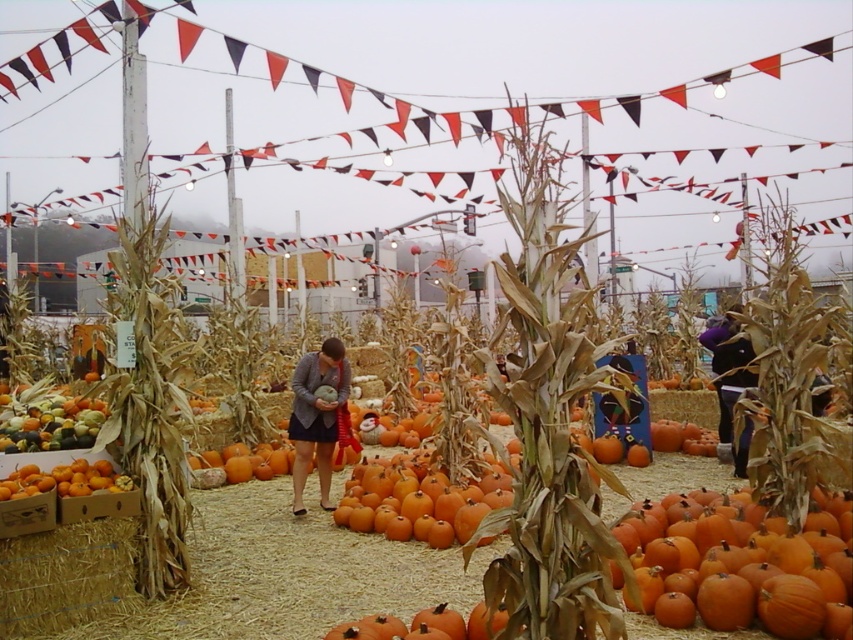
Question: Can you confirm if matte gray sweater at center is smaller than orange matte pumpkin at lower left?

Choices:
 (A) yes
 (B) no

Answer: (B)

Question: Observing the image, what is the correct spatial positioning of orange matte pumpkin at center in reference to orange matte pumpkin at lower left?

Choices:
 (A) above
 (B) below

Answer: (B)

Question: Among these objects, which one is farthest from the camera?

Choices:
 (A) matte gray sweater at center
 (B) purple fleece jacket at center
 (C) multicolored gourds at lower left
 (D) orange matte pumpkin at lower left

Answer: (A)

Question: Is multicolored gourds at lower left positioned in front of orange matte pumpkin at lower center?

Choices:
 (A) no
 (B) yes

Answer: (A)

Question: Which object appears farthest from the camera in this image?

Choices:
 (A) orange matte pumpkin at lower left
 (B) orange matte pumpkin at center

Answer: (A)

Question: Which point is farther from the camera taking this photo?

Choices:
 (A) (126, 484)
 (B) (325, 339)
 (C) (9, 406)
 (D) (738, 321)

Answer: (B)